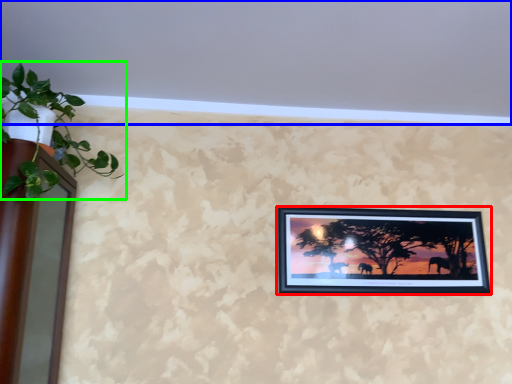
Question: Considering the real-world distances, which object is closest to picture frame (highlighted by a red box)? backdrop (highlighted by a blue box) or houseplant (highlighted by a green box).

Choices:
 (A) backdrop
 (B) houseplant

Answer: (A)